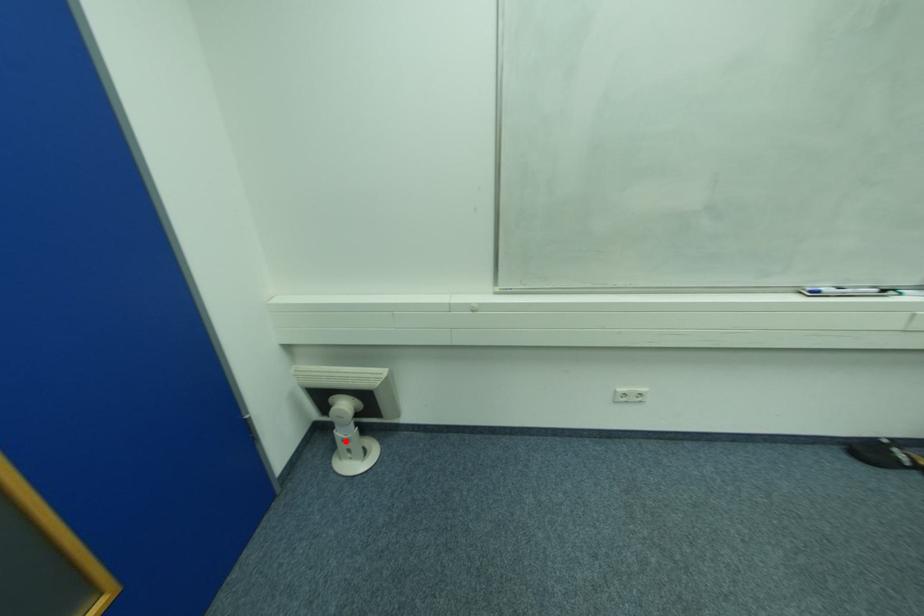
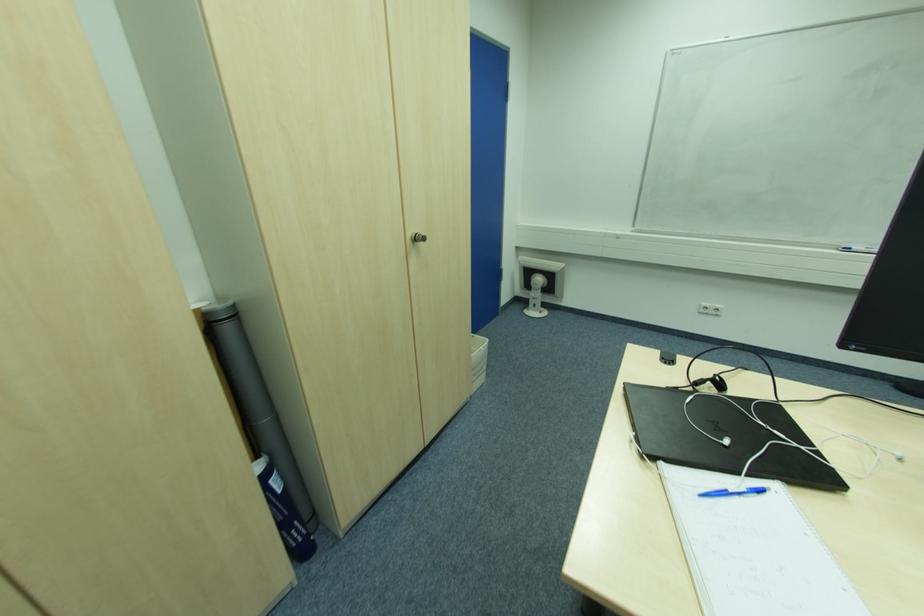
Locate, in the second image, the point that corresponds to the highlighted location in the first image.

(536, 300)